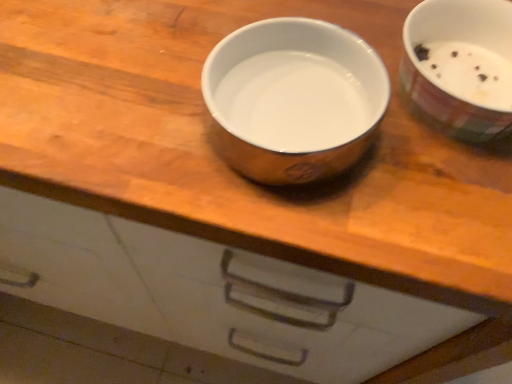
Locate an element on the screen. free location to the right of satin silver bowl at center, marked as the 1th tableware in a left-to-right arrangement is located at coordinates (437, 196).